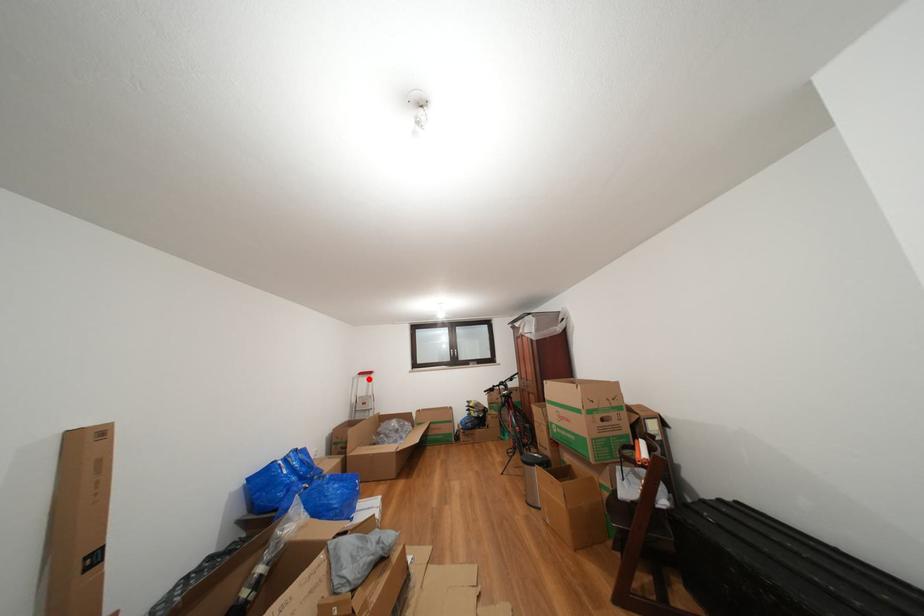
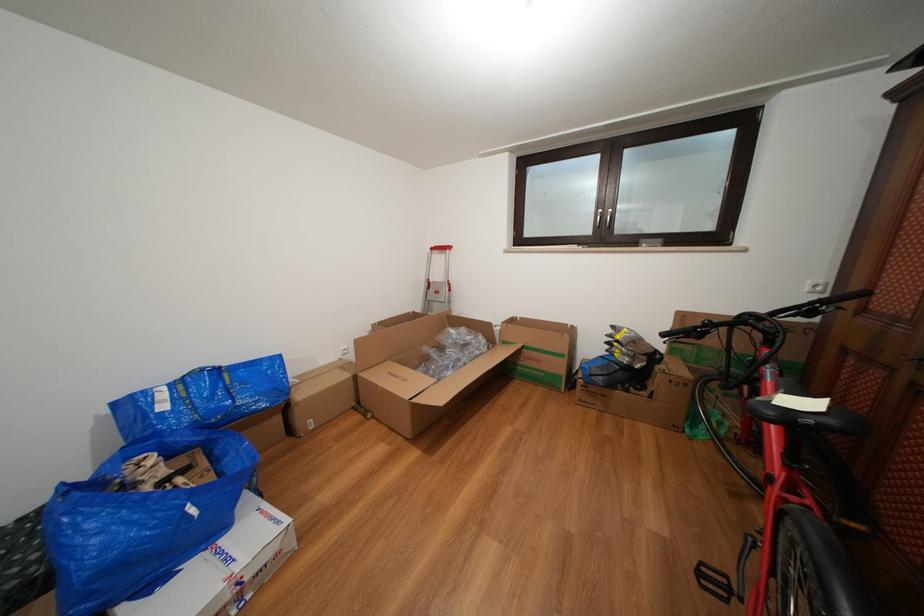
Question: I am providing you with two images of the same scene from different viewpoints. Image1 has a red point marked. In image2, the corresponding 3D location appears at what relative position? Reply with the corresponding letter.

Choices:
 (A) Closer
 (B) Farther

Answer: (A)